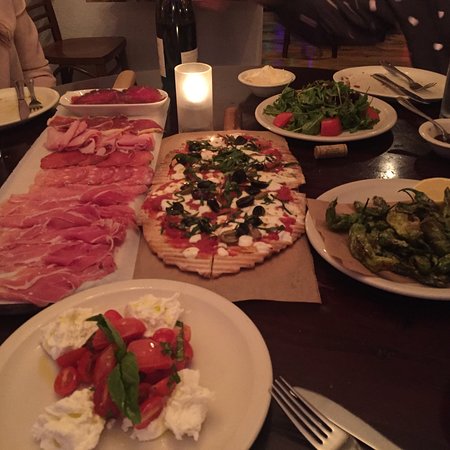
You are a GUI agent. You are given a task and a screenshot of the screen. Output one action in this format:
    pyautogui.click(x=<x>, y=<y>)
    Task: Click on the tabletop
    
    Given the screenshot: What is the action you would take?
    pyautogui.click(x=338, y=340)